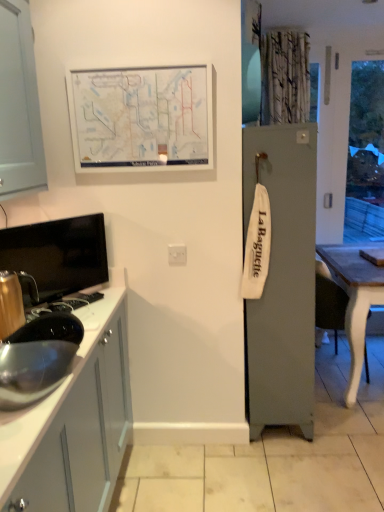
What is the approximate height of white matte map at upper center?

white matte map at upper center is 18.26 inches tall.

At what (x,y) coordinates should I click in order to perform the action: click on metallic gold kettle at left. Please return your answer as a coordinate pair (x, y). The width and height of the screenshot is (384, 512). Looking at the image, I should click on (10, 304).

Where is `white plastic electric outlet at center`? This screenshot has height=512, width=384. white plastic electric outlet at center is located at coordinates (177, 254).

Is point (361, 273) behind point (180, 255)?

Yes.

Between wooden table at right and white plastic electric outlet at center, which one has larger size?

wooden table at right.

Looking at this image, from the image's perspective, which is above, wooden table at right or white plastic electric outlet at center?

white plastic electric outlet at center.

From the picture: Which of these two, wooden table at right or white plastic electric outlet at center, is wider?

With larger width is wooden table at right.

Is metallic gold kettle at left not inside white matte map at upper center?

Absolutely, metallic gold kettle at left is external to white matte map at upper center.

Considering the sizes of metallic gold kettle at left and white matte map at upper center in the image, is metallic gold kettle at left bigger or smaller than white matte map at upper center?

metallic gold kettle at left is smaller than white matte map at upper center.

Looking at their sizes, would you say metallic gold kettle at left is wider or thinner than white matte map at upper center?

Considering their sizes, metallic gold kettle at left looks broader than white matte map at upper center.

In the scene shown: Considering the sizes of objects metallic gold kettle at left and white matte map at upper center in the image provided, who is taller, metallic gold kettle at left or white matte map at upper center?

white matte map at upper center is taller.

Between point (138, 114) and point (3, 283), which one is positioned in front?

Positioned in front is point (3, 283).

From the image's perspective, is white matte map at upper center located above or below metallic gold kettle at left?

From the image's perspective, white matte map at upper center appears above metallic gold kettle at left.

Between white matte map at upper center and metallic gold kettle at left, which one has larger width?

Wider between the two is metallic gold kettle at left.

In the scene shown: Is white matte map at upper center not inside metallic gold kettle at left?

Absolutely, white matte map at upper center is external to metallic gold kettle at left.

From a real-world perspective, is satin silver sink at lower left physically below white matte map at upper center?

Yes, from a real-world perspective, satin silver sink at lower left is beneath white matte map at upper center.

Could white matte map at upper center be considered to be inside satin silver sink at lower left?

No, satin silver sink at lower left does not contain white matte map at upper center.

Can you confirm if satin silver sink at lower left is smaller than white matte map at upper center?

Yes, satin silver sink at lower left is smaller than white matte map at upper center.

Measure the distance between satin silver sink at lower left and white matte map at upper center.

A distance of 18.41 inches exists between satin silver sink at lower left and white matte map at upper center.

From the image's perspective, is white plastic electric outlet at center below white matte map at upper center?

Yes.

Considering the relative sizes of white plastic electric outlet at center and white matte map at upper center in the image provided, is white plastic electric outlet at center smaller than white matte map at upper center?

Yes, white plastic electric outlet at center is smaller than white matte map at upper center.

Does point (175, 247) come farther from viewer compared to point (139, 130)?

Yes.

Between satin silver sink at lower left and white plastic electric outlet at center, which one has less height?

white plastic electric outlet at center is shorter.

Is satin silver sink at lower left in front of or behind white plastic electric outlet at center in the image?

In the image, satin silver sink at lower left appears in front of white plastic electric outlet at center.

Can you see satin silver sink at lower left touching white plastic electric outlet at center?

No, satin silver sink at lower left is not touching white plastic electric outlet at center.

Between point (54, 251) and point (4, 289), which one is positioned behind?

The point (54, 251) is farther from the camera.

From a real-world perspective, is satin silver sink at lower left on metallic gold kettle at left?

Yes, from a real-world perspective, satin silver sink at lower left is on top of metallic gold kettle at left.

Which is correct: satin silver sink at lower left is inside metallic gold kettle at left, or outside of it?

satin silver sink at lower left lies outside metallic gold kettle at left.

Find the location of a particular element. appliance located underneath the satin silver sink at lower left (from a real-world perspective) is located at coordinates 10,304.

Where is `electric outlet in front of the wooden table at right`? The width and height of the screenshot is (384, 512). electric outlet in front of the wooden table at right is located at coordinates pyautogui.click(x=177, y=254).

This screenshot has width=384, height=512. I want to click on appliance below the white matte map at upper center (from a real-world perspective), so click(x=10, y=304).

Considering their positions, is wooden table at right positioned closer to white plastic electric outlet at center than satin silver sink at lower left?

satin silver sink at lower left is positioned closer to the anchor white plastic electric outlet at center.

Considering their positions, is metallic gold kettle at left positioned closer to white plastic electric outlet at center than wooden table at right?

metallic gold kettle at left lies closer to white plastic electric outlet at center than the other object.

Considering their positions, is white plastic electric outlet at center positioned further to wooden table at right than satin silver sink at lower left?

Based on the image, satin silver sink at lower left appears to be further to wooden table at right.

Which object lies nearer to the anchor point satin silver sink at lower left, wooden table at right or white plastic electric outlet at center?

Among the two, white plastic electric outlet at center is located nearer to satin silver sink at lower left.

Looking at the image, which one is located further to white plastic electric outlet at center, wooden table at right or white matte map at upper center?

Based on the image, wooden table at right appears to be further to white plastic electric outlet at center.

Looking at the image, which one is located closer to white matte map at upper center, white plastic electric outlet at center or metallic gold kettle at left?

white plastic electric outlet at center is closer to white matte map at upper center.

When comparing their distances from metallic gold kettle at left, does white plastic electric outlet at center or satin silver sink at lower left seem further?

Among the two, white plastic electric outlet at center is located further to metallic gold kettle at left.

Which object lies further to the anchor point white matte map at upper center, wooden table at right or white plastic electric outlet at center?

wooden table at right lies further to white matte map at upper center than the other object.

Where is `electric outlet located between metallic gold kettle at left and wooden table at right in the left-right direction`? The image size is (384, 512). electric outlet located between metallic gold kettle at left and wooden table at right in the left-right direction is located at coordinates (177, 254).

The width and height of the screenshot is (384, 512). In order to click on bulletin board between metallic gold kettle at left and wooden table at right in this screenshot , I will do `click(140, 117)`.

Locate an element on the screen. The image size is (384, 512). electric outlet between white matte map at upper center and wooden table at right in the horizontal direction is located at coordinates (177, 254).

Identify the location of electric outlet between white matte map at upper center and satin silver sink at lower left in the vertical direction. Image resolution: width=384 pixels, height=512 pixels. click(177, 254).